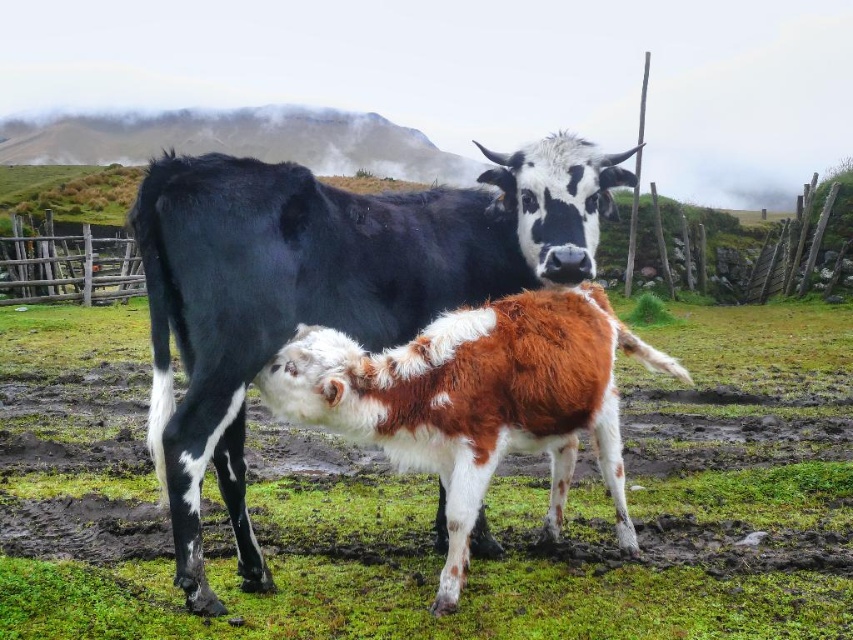
Question: Which point is closer to the camera?

Choices:
 (A) (223, 342)
 (B) (96, 618)

Answer: (B)

Question: Which of the following is the closest to the observer?

Choices:
 (A) wooden fence at left
 (B) black and white cow at center

Answer: (B)

Question: Is brown fuzzy calf at center to the right of black and white cow at center from the viewer's perspective?

Choices:
 (A) no
 (B) yes

Answer: (B)

Question: Where is brown fuzzy calf at center located in relation to wooden fence at left in the image?

Choices:
 (A) above
 (B) below

Answer: (B)

Question: Which point appears farthest from the camera in this image?

Choices:
 (A) (51, 269)
 (B) (264, 291)

Answer: (A)

Question: Is brown fuzzy calf at center positioned before wooden fence at left?

Choices:
 (A) no
 (B) yes

Answer: (B)